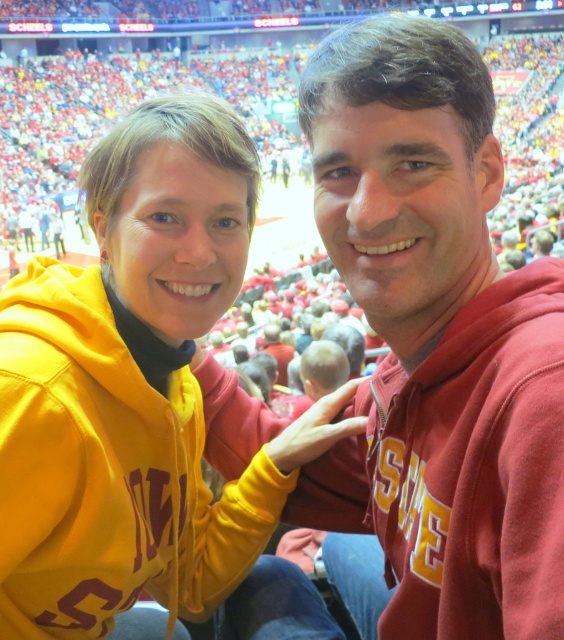
Question: Which object appears closest to the camera in this image?

Choices:
 (A) matte red hoodie at center
 (B) matte yellow hoodie at center

Answer: (A)

Question: Is matte yellow hoodie at center further to camera compared to matte red hoodie at center?

Choices:
 (A) no
 (B) yes

Answer: (B)

Question: Is matte yellow hoodie at center positioned behind matte red hoodie at center?

Choices:
 (A) yes
 (B) no

Answer: (A)

Question: In this image, where is matte yellow hoodie at center located relative to matte red hoodie at center?

Choices:
 (A) above
 (B) below

Answer: (B)

Question: Which object is closer to the camera taking this photo?

Choices:
 (A) matte yellow hoodie at center
 (B) matte red hoodie at center

Answer: (B)